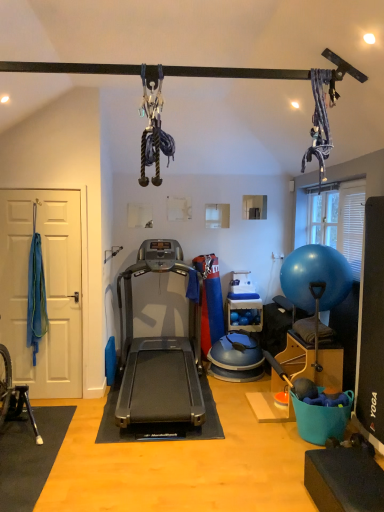
Locate an element on the screen. The width and height of the screenshot is (384, 512). silver metallic treadmill at center is located at coordinates (159, 353).

Image resolution: width=384 pixels, height=512 pixels. What do you see at coordinates (159, 353) in the screenshot?
I see `silver metallic treadmill at center` at bounding box center [159, 353].

What is the approximate height of blue rubber ball at right?

The height of blue rubber ball at right is 24.66 inches.

Measure the distance between point (293, 270) and camera.

The depth of point (293, 270) is 3.60 meters.

This screenshot has height=512, width=384. What do you see at coordinates (315, 277) in the screenshot?
I see `blue rubber ball at right` at bounding box center [315, 277].

The width and height of the screenshot is (384, 512). Find the location of `blue rubber ball at right`. blue rubber ball at right is located at coordinates (315, 277).

The image size is (384, 512). I want to click on silver metallic treadmill at center, so click(159, 353).

In the image, is blue rubber ball at right on the left side or the right side of silver metallic treadmill at center?

Clearly, blue rubber ball at right is on the right of silver metallic treadmill at center in the image.

Relative to silver metallic treadmill at center, is blue rubber ball at right in front or behind?

blue rubber ball at right is behind silver metallic treadmill at center.

Between point (309, 289) and point (152, 251), which one is positioned in front?

Positioned in front is point (309, 289).

From the image's perspective, between blue rubber ball at right and silver metallic treadmill at center, which one is located above?

From the image's view, blue rubber ball at right is above.

From a real-world perspective, which object rests below the other?

From a 3D spatial view, silver metallic treadmill at center is below.

Between blue rubber ball at right and silver metallic treadmill at center, which one has smaller width?

blue rubber ball at right.

Does blue rubber ball at right have a lesser height compared to silver metallic treadmill at center?

Indeed, blue rubber ball at right has a lesser height compared to silver metallic treadmill at center.

Is blue rubber ball at right smaller than silver metallic treadmill at center?

Correct, blue rubber ball at right occupies less space than silver metallic treadmill at center.

From the picture: Would you say silver metallic treadmill at center is part of blue rubber ball at right's contents?

No, silver metallic treadmill at center is not a part of blue rubber ball at right.

Is blue rubber ball at right positioned far away from silver metallic treadmill at center?

Yes, blue rubber ball at right and silver metallic treadmill at center are located far from each other.

Is blue rubber ball at right turned away from silver metallic treadmill at center?

No, silver metallic treadmill at center is not at the back of blue rubber ball at right.

How different are the orientations of blue rubber ball at right and silver metallic treadmill at center in degrees?

89.5 degrees separate the facing orientations of blue rubber ball at right and silver metallic treadmill at center.

This screenshot has width=384, height=512. I want to click on treadmill on the left of blue rubber ball at right, so click(x=159, y=353).

Based on the photo, is silver metallic treadmill at center at the right side of blue rubber ball at right?

No.

Considering the relative positions of silver metallic treadmill at center and blue rubber ball at right in the image provided, is silver metallic treadmill at center in front of blue rubber ball at right?

Yes, the depth of silver metallic treadmill at center is less than that of blue rubber ball at right.

Which is nearer, (142, 397) or (298, 280)?

The point (298, 280) is closer to the camera.

From the image's perspective, who appears lower, silver metallic treadmill at center or blue rubber ball at right?

silver metallic treadmill at center appears lower in the image.

From a real-world perspective, is silver metallic treadmill at center positioned above or below blue rubber ball at right?

Clearly, from a real-world perspective, silver metallic treadmill at center is below blue rubber ball at right.

Which of these two, silver metallic treadmill at center or blue rubber ball at right, is wider?

Wider between the two is silver metallic treadmill at center.

Considering the relative sizes of silver metallic treadmill at center and blue rubber ball at right in the image provided, is silver metallic treadmill at center taller than blue rubber ball at right?

Yes.

Considering the sizes of objects silver metallic treadmill at center and blue rubber ball at right in the image provided, who is smaller, silver metallic treadmill at center or blue rubber ball at right?

Smaller between the two is blue rubber ball at right.

Would you say silver metallic treadmill at center is inside or outside blue rubber ball at right?

silver metallic treadmill at center exists outside the volume of blue rubber ball at right.

Is silver metallic treadmill at center directly adjacent to blue rubber ball at right?

No, silver metallic treadmill at center is not next to blue rubber ball at right.

Is silver metallic treadmill at center oriented away from blue rubber ball at right?

silver metallic treadmill at center is not turned away from blue rubber ball at right.

How distant is silver metallic treadmill at center from blue rubber ball at right?

silver metallic treadmill at center is 4.82 feet from blue rubber ball at right.

The image size is (384, 512). In order to click on ball to the right of silver metallic treadmill at center in this screenshot , I will do `click(315, 277)`.

Image resolution: width=384 pixels, height=512 pixels. What are the coordinates of `ball located on the right of silver metallic treadmill at center` in the screenshot? It's located at (315, 277).

The height and width of the screenshot is (512, 384). In order to click on ball positioned vertically above the silver metallic treadmill at center (from a real-world perspective) in this screenshot , I will do `click(315, 277)`.